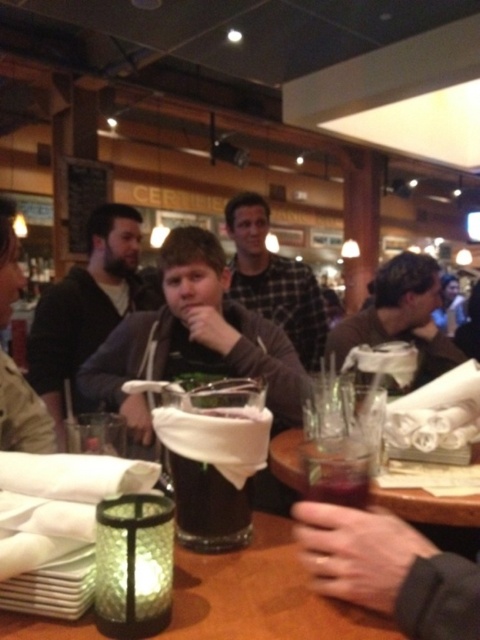
You are a server in a restaurant and need to place a new drink order on the table. Where should you place the drink so it doesn not interfere with the plaid flannel shirt at center?

The plaid flannel shirt at center is located at point (274,280), so you should place the drink away from that coordinate to avoid interference.

You are a person who is 1.7 meters tall and standing in front of the table. You want to pick up the matte black jacket at center. Can you reach it without moving your feet?

The matte black jacket at center is 1.06 meters from viewer. Since the jacket is 1.06 meters away and you are 1.7 meters tall, you can likely reach it by stretching your arms forward as your arm length is typically shorter than your height, but it depends on your arm reach. However, the question states to use the objects description. Since the jacket is 1.06 meters away from the viewer, and assuming an average arm reach of about 1 meter, you might not be able to reach it without moving closer.